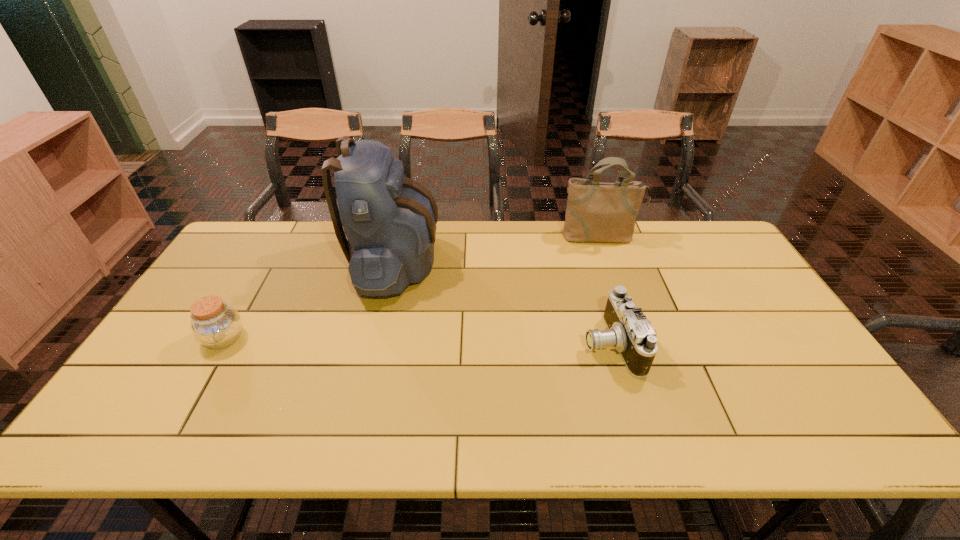
Locate an element on the screen. vacant space located at the lens of the camera is located at coordinates (488, 344).

Image resolution: width=960 pixels, height=540 pixels. Find the location of `backpack that is at the far edge`. backpack that is at the far edge is located at coordinates point(389,220).

I want to click on shoulder bag present at the far edge, so click(596, 211).

This screenshot has width=960, height=540. What are the coordinates of `object situated at the left edge` in the screenshot? It's located at point(215,324).

Identify the location of vacant space at the far edge. The height and width of the screenshot is (540, 960). (548, 261).

Locate an element on the screen. free space at the near edge of the desktop is located at coordinates (196, 424).

The image size is (960, 540). I want to click on free space at the left edge, so [242, 290].

Find the location of a particular element. The width and height of the screenshot is (960, 540). free point at the right edge is located at coordinates (706, 283).

Image resolution: width=960 pixels, height=540 pixels. I want to click on vacant region at the near left corner of the desktop, so click(x=142, y=415).

Find the location of a particular element. The height and width of the screenshot is (540, 960). free space between the backpack and the camera is located at coordinates (504, 303).